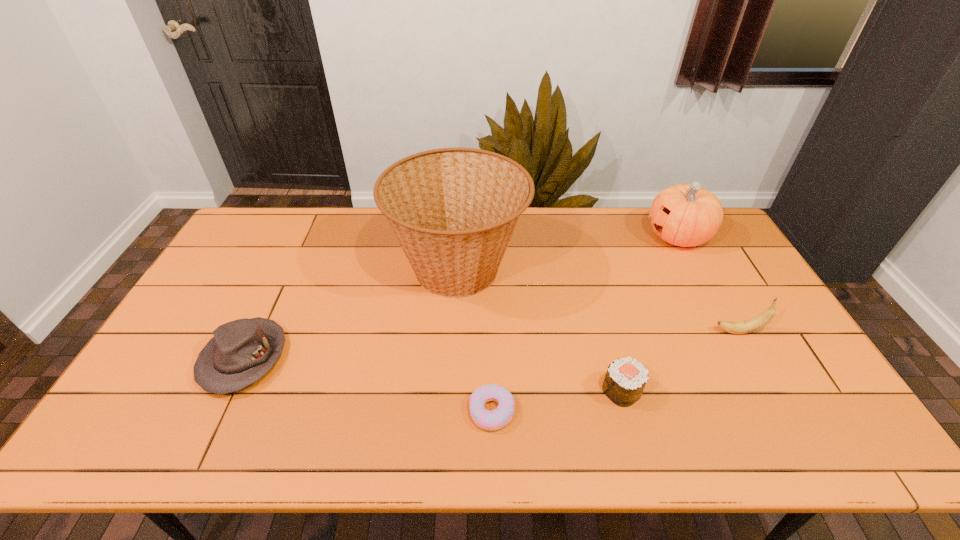
In order to click on object identified as the fifth closest to the pumpkin in this screenshot , I will do `click(242, 351)`.

Identify the location of blank space that satisfies the following two spatial constraints: 1. on the decorative side of the hat; 2. on the right side of the shortest object. The height and width of the screenshot is (540, 960). (219, 411).

Identify the location of free space that satisfies the following two spatial constraints: 1. at the start of the peel on the third tallest object; 2. on the decorative side of the leftmost object. The width and height of the screenshot is (960, 540). (754, 358).

The height and width of the screenshot is (540, 960). I want to click on blank area in the image that satisfies the following two spatial constraints: 1. on the decorative side of the third object from right to left; 2. on the right side of the leftmost object, so click(x=228, y=391).

Identify the location of vacant area that satisfies the following two spatial constraints: 1. at the start of the peel on the third tallest object; 2. on the decorative side of the leftmost object. The image size is (960, 540). (754, 358).

Image resolution: width=960 pixels, height=540 pixels. Identify the location of free space that satisfies the following two spatial constraints: 1. at the start of the peel on the fourth shortest object; 2. on the front side of the doughnut. (783, 411).